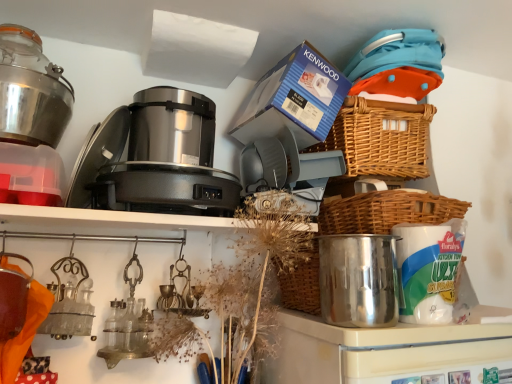
Question: Considering the positions of blue cardboard box at upper center and woven brown basket at upper right, the 1th basket when ordered from top to bottom, in the image, is blue cardboard box at upper center wider or thinner than woven brown basket at upper right, the 1th basket when ordered from top to bottom,?

Choices:
 (A) wide
 (B) thin

Answer: (A)

Question: Is blue cardboard box at upper center inside or outside of woven brown basket at upper right, acting as the second basket starting from the bottom?

Choices:
 (A) inside
 (B) outside

Answer: (B)

Question: Considering the real-world distances, which object is closest to the shiny metallic pot at center-right, marked as the 1th appliance in a right-to-left arrangement?

Choices:
 (A) satin metallic food processor at center, which is the 2th appliance from bottom to top
 (B) blue cardboard box at upper center
 (C) metallic glass jar at upper left
 (D) woven brown basket at right, the 2th basket from the top
 (E) woven brown basket at upper right, acting as the second basket starting from the bottom

Answer: (D)

Question: Which of these objects is positioned closest to the woven brown basket at right, the 2th basket from the top?

Choices:
 (A) metallic glass jar at upper left
 (B) satin metallic food processor at center, marked as the 2th appliance in a right-to-left arrangement
 (C) shiny metallic pot at center-right, acting as the second appliance starting from the back
 (D) blue cardboard box at upper center
 (E) woven brown basket at upper right, acting as the second basket starting from the bottom

Answer: (C)